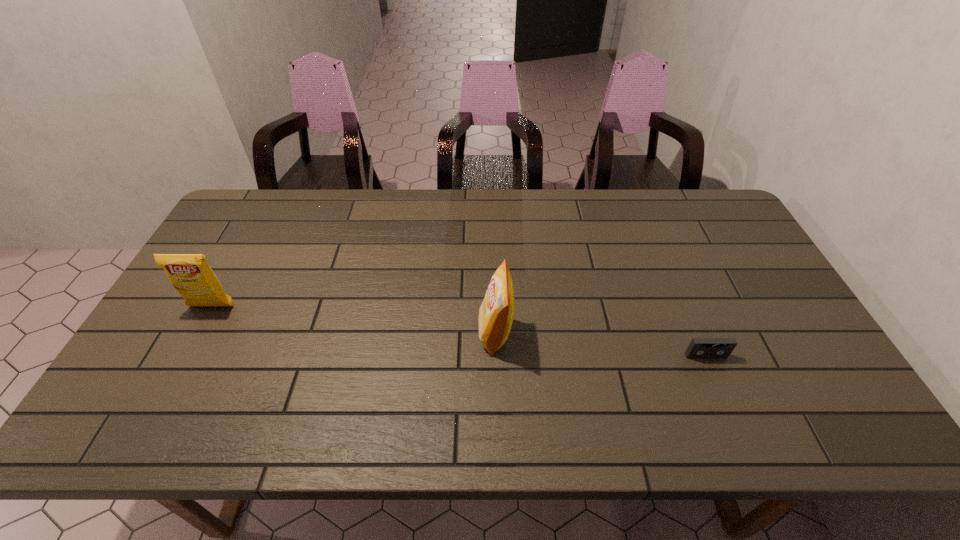
Image resolution: width=960 pixels, height=540 pixels. Find the location of `the second object from right to left`. the second object from right to left is located at coordinates (496, 313).

You are a GUI agent. You are given a task and a screenshot of the screen. Output one action in this format:
    pyautogui.click(x=<x>, y=<y>)
    Task: Click on the left crisp (potato chip)
    The image size is (960, 540).
    Given the screenshot: What is the action you would take?
    pyautogui.click(x=190, y=274)

In order to click on videotape in this screenshot , I will do `click(699, 347)`.

I want to click on the shortest object, so click(699, 347).

The width and height of the screenshot is (960, 540). Identify the location of free space located on the front-facing side of the second object from left to right. (452, 334).

The height and width of the screenshot is (540, 960). Identify the location of vacant point located 0.300m on the front-facing side of the second object from left to right. (364, 334).

This screenshot has width=960, height=540. Find the location of `vacant space located 0.250m on the front-facing side of the second object from left to right`. vacant space located 0.250m on the front-facing side of the second object from left to right is located at coordinates (383, 334).

The image size is (960, 540). Identify the location of vacant area situated on the front of the leftmost object with the logo. (174, 376).

This screenshot has width=960, height=540. I want to click on free location located on the front-facing side of the shortest object, so click(722, 394).

What are the coordinates of `object that is at the left edge` in the screenshot? It's located at (190, 274).